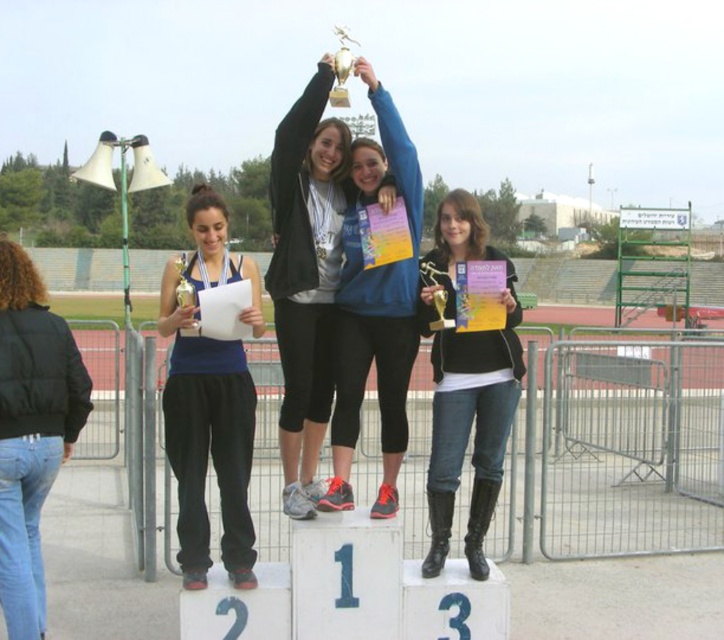
You are a photographer standing at the back of the podium. You need to take a photo of both the black leather boots at center and the black puffy jacket at lower left. Considering their sizes, which object will appear bigger in the photo?

The black leather boots at center will appear bigger in the photo since it is larger in size than the black puffy jacket at lower left.

You are a photographer at the event and want to ensure both the matte blue tank top at left and the gold metallic trophy at center are clearly visible in your photo. Which object should you focus on first to ensure it appears sharp, considering their sizes?

The matte blue tank top at left is larger in size than the gold metallic trophy at center, so you should focus on the matte blue tank top at left first to ensure it appears sharp.

You are a photographer standing at the back of the track, and you want to take a photo of the podium ceremony. You notice two points in the image labeled as point (x=206, y=406) and point (x=437, y=273). Which point is closer to you?

Point (x=206, y=406) is closer to the viewer than point (x=437, y=273).